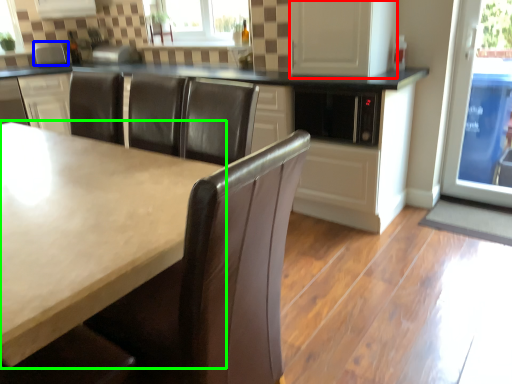
Question: Estimate the real-world distances between objects in this image. Which object is closer to screen door (highlighted by a red box), appliance (highlighted by a blue box) or countertop (highlighted by a green box)?

Choices:
 (A) appliance
 (B) countertop

Answer: (B)